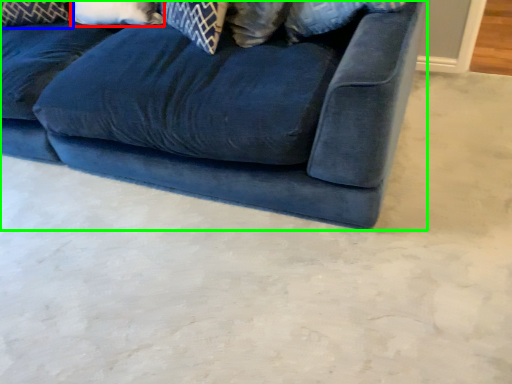
Question: Based on their relative distances, which object is nearer to pillow (highlighted by a red box)? Choose from pillow (highlighted by a blue box) and studio couch (highlighted by a green box).

Choices:
 (A) pillow
 (B) studio couch

Answer: (A)